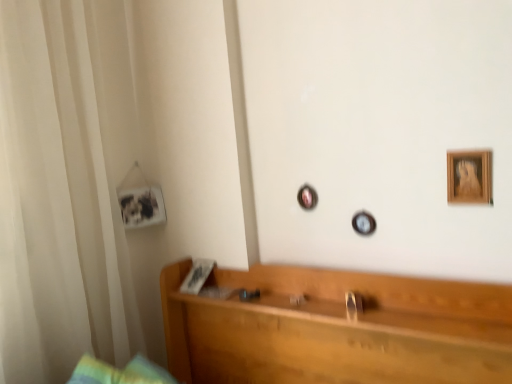
Question: From the image's perspective, is wooden picture frame at upper right, the first picture frame viewed from the front, beneath wooden headboard at center?

Choices:
 (A) no
 (B) yes

Answer: (A)

Question: From a real-world perspective, is wooden picture frame at upper right, placed as the 2th picture frame when sorted from left to right, located beneath wooden headboard at center?

Choices:
 (A) no
 (B) yes

Answer: (A)

Question: Is wooden picture frame at upper right, the first picture frame viewed from the front, facing away from wooden headboard at center?

Choices:
 (A) yes
 (B) no

Answer: (B)

Question: Is the depth of wooden picture frame at upper right, positioned as the 1th picture frame in right-to-left order, less than that of wooden headboard at center?

Choices:
 (A) yes
 (B) no

Answer: (B)

Question: Does wooden picture frame at upper right, the first picture frame viewed from the front, have a lesser height compared to wooden headboard at center?

Choices:
 (A) no
 (B) yes

Answer: (A)

Question: In the image, is white sheer curtain at left positioned in front of or behind wooden picture frame at upper right, the first picture frame viewed from the front?

Choices:
 (A) front
 (B) behind

Answer: (B)

Question: Is white sheer curtain at left situated inside wooden picture frame at upper right, the 2th picture frame in the back-to-front sequence, or outside?

Choices:
 (A) inside
 (B) outside

Answer: (B)

Question: Considering the relative positions of white sheer curtain at left and wooden picture frame at upper right, the 2th picture frame in the back-to-front sequence, in the image provided, is white sheer curtain at left to the left or to the right of wooden picture frame at upper right, the 2th picture frame in the back-to-front sequence,?

Choices:
 (A) left
 (B) right

Answer: (A)

Question: From a real-world perspective, is white sheer curtain at left physically located above or below wooden picture frame at upper right, the 2th picture frame in the back-to-front sequence?

Choices:
 (A) below
 (B) above

Answer: (B)

Question: Considering the positions of wooden headboard at center and wooden picture frame at upper right, the first picture frame viewed from the front, in the image, is wooden headboard at center wider or thinner than wooden picture frame at upper right, the first picture frame viewed from the front,?

Choices:
 (A) wide
 (B) thin

Answer: (A)

Question: Is point (188, 347) positioned closer to the camera than point (466, 188)?

Choices:
 (A) farther
 (B) closer

Answer: (A)

Question: Is wooden headboard at center taller or shorter than wooden picture frame at upper right, the first picture frame viewed from the front?

Choices:
 (A) tall
 (B) short

Answer: (B)

Question: Based on their sizes in the image, would you say wooden headboard at center is bigger or smaller than wooden picture frame at upper right, placed as the 2th picture frame when sorted from left to right?

Choices:
 (A) small
 (B) big

Answer: (B)

Question: Considering the positions of white sheer curtain at left and wooden headboard at center in the image, is white sheer curtain at left wider or thinner than wooden headboard at center?

Choices:
 (A) wide
 (B) thin

Answer: (A)

Question: From the image's perspective, is white sheer curtain at left above or below wooden headboard at center?

Choices:
 (A) below
 (B) above

Answer: (B)